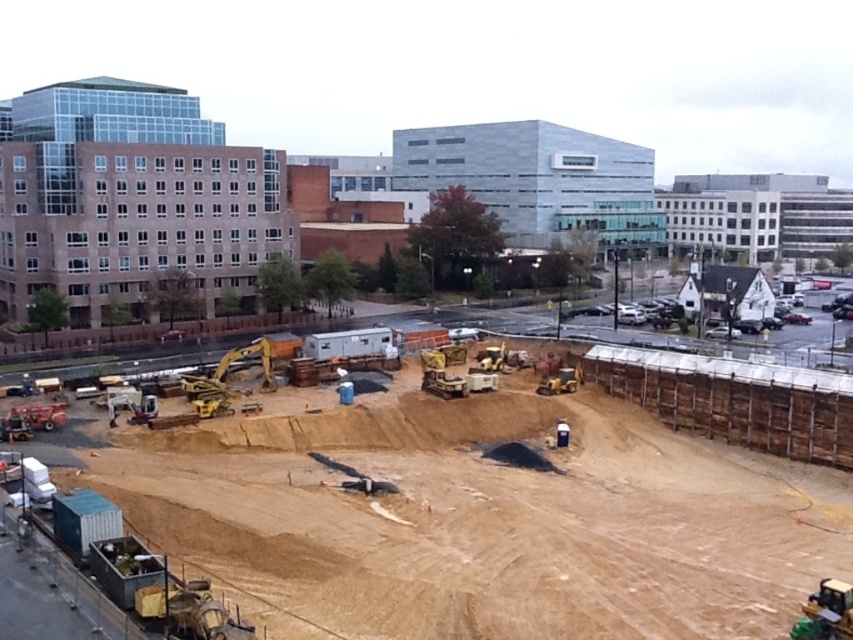
Question: Which object appears farthest from the camera in this image?

Choices:
 (A) brown dirt at center
 (B) yellow rubber at center
 (C) gray metallic building at center

Answer: (C)

Question: Can you confirm if brown dirt at center is wider than yellow rubber at center?

Choices:
 (A) no
 (B) yes

Answer: (B)

Question: Is gray metallic building at center closer to camera compared to yellow rubber at center?

Choices:
 (A) yes
 (B) no

Answer: (B)

Question: Which point is farther to the camera?

Choices:
 (A) (561, 369)
 (B) (485, 138)

Answer: (B)

Question: Does brown dirt at center lie in front of yellow rubber at center?

Choices:
 (A) no
 (B) yes

Answer: (B)

Question: Which point appears closest to the camera in this image?

Choices:
 (A) (641, 244)
 (B) (579, 380)

Answer: (B)